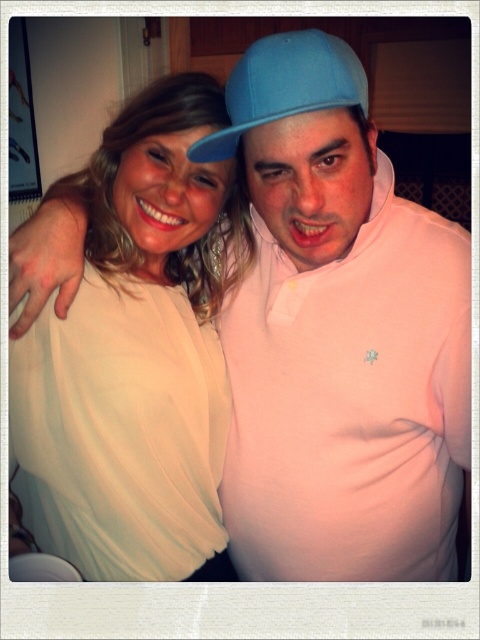
Based on the photo, you are a photographer trying to adjust the lighting for a portrait. You notice the matte white blouse at center and the matte blue cap at center. Which object should you focus on first if you want to ensure the taller object is properly lit?

The matte white blouse at center is taller than the matte blue cap at center, so you should focus on lighting the matte white blouse at center first to ensure proper illumination.

You are a photographer trying to capture the perfect shot of the two people in the image. You notice a specific point at coordinates (137, 352). What object is located at this point?

The point at coordinates (137, 352) corresponds to the matte white blouse at center.